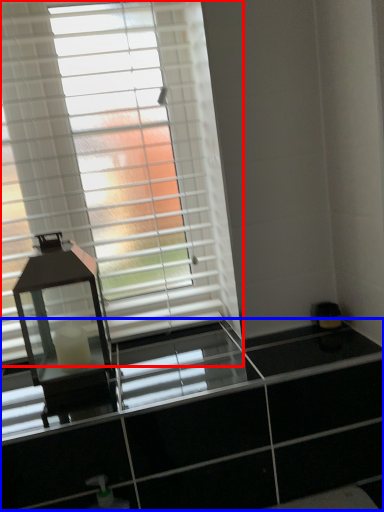
Question: Which object is closer to the camera taking this photo, window blind (highlighted by a red box) or dresser (highlighted by a blue box)?

Choices:
 (A) window blind
 (B) dresser

Answer: (B)